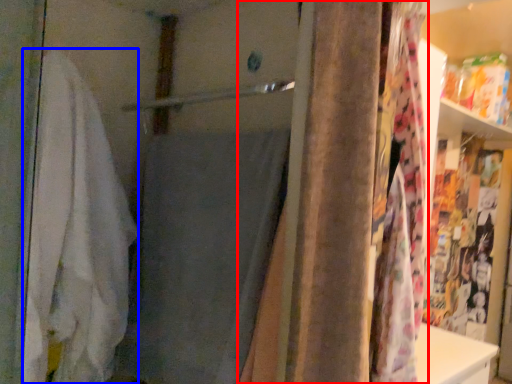
Question: Which of the following is the closest to the observer, curtain (highlighted by a red box) or bath towel (highlighted by a blue box)?

Choices:
 (A) curtain
 (B) bath towel

Answer: (A)